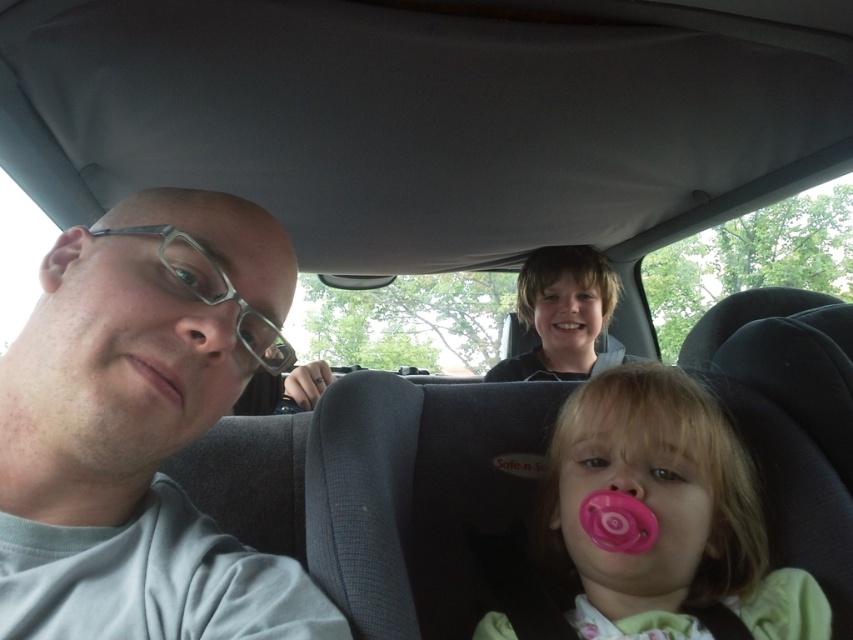
Does pink rubber pacifier at lower center have a greater width compared to pink rubber pacifier at center?

Indeed, pink rubber pacifier at lower center has a greater width compared to pink rubber pacifier at center.

Which of these two, pink rubber pacifier at lower center or pink rubber pacifier at center, stands shorter?

Standing shorter between the two is pink rubber pacifier at center.

Between point (637, 362) and point (610, 460), which one is positioned in front?

Point (610, 460) is more forward.

This screenshot has height=640, width=853. Identify the location of pink rubber pacifier at lower center. (670, 515).

Is pink rubber pacifier at lower center shorter than smooth black hoodie at upper center?

Indeed, pink rubber pacifier at lower center has a lesser height compared to smooth black hoodie at upper center.

This screenshot has height=640, width=853. Describe the element at coordinates (670, 515) in the screenshot. I see `pink rubber pacifier at lower center` at that location.

Where is `pink rubber pacifier at lower center`? The height and width of the screenshot is (640, 853). pink rubber pacifier at lower center is located at coordinates (670, 515).

Does gray matte glasses at left have a lesser width compared to pink matte lips at lower left?

No, gray matte glasses at left is not thinner than pink matte lips at lower left.

Does gray matte glasses at left have a smaller size compared to pink matte lips at lower left?

Actually, gray matte glasses at left might be larger than pink matte lips at lower left.

Identify the location of gray matte glasses at left. This screenshot has width=853, height=640. (138, 433).